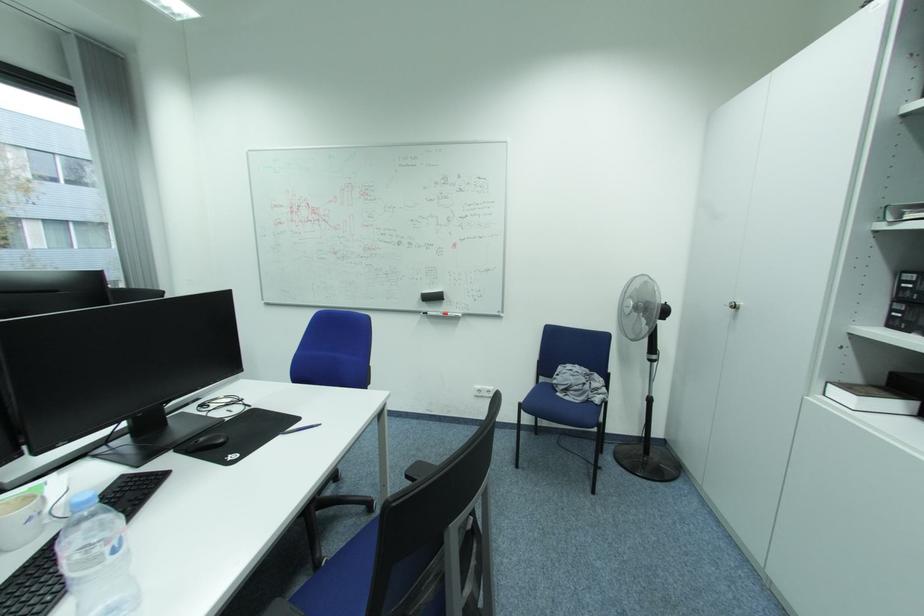
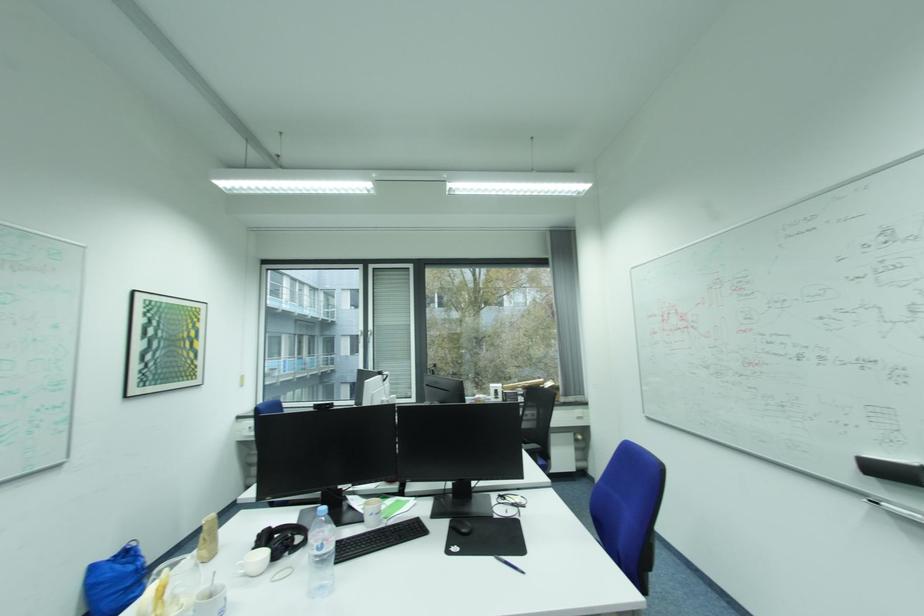
The point at (433, 302) is marked in the first image. Where is the corresponding point in the second image?

(880, 477)